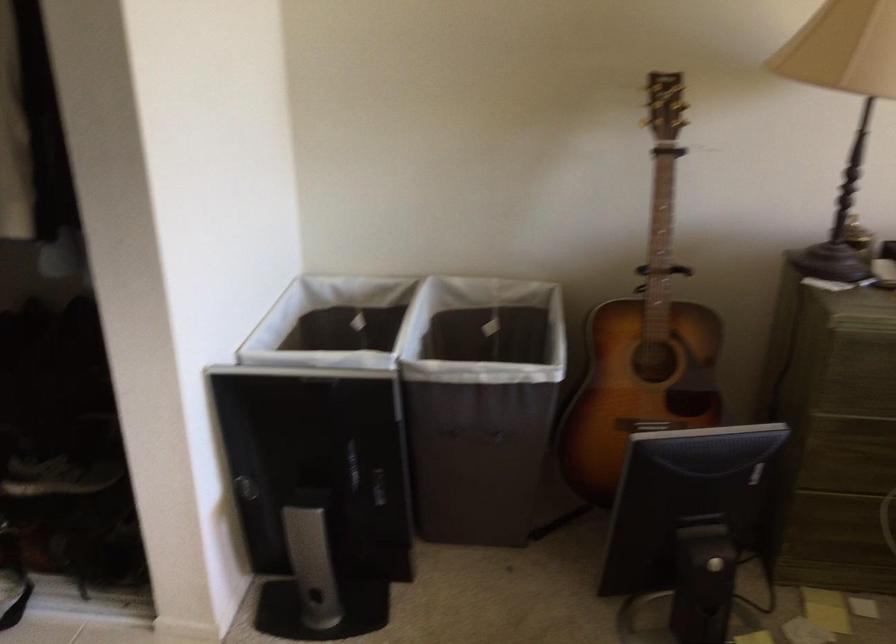
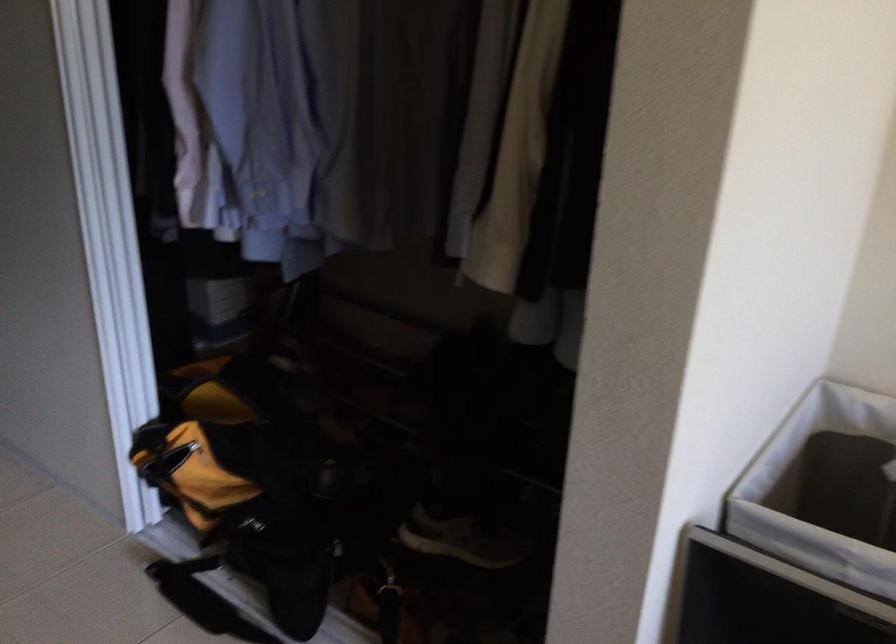
Question: The camera is either moving clockwise (left) or counter-clockwise (right) around the object. The first image is from the beginning of the video and the second image is from the end. Is the camera moving left or right when shooting the video?

Choices:
 (A) Left
 (B) Right

Answer: (B)